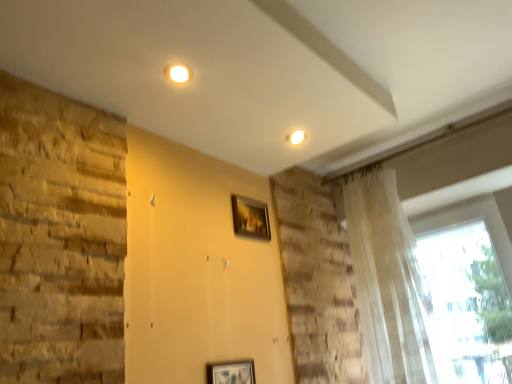
Question: Can you confirm if wooden frame at center is positioned to the left of translucent fabric curtain at upper right?

Choices:
 (A) no
 (B) yes

Answer: (B)

Question: Could you tell me if wooden frame at center is turned towards translucent fabric curtain at upper right?

Choices:
 (A) no
 (B) yes

Answer: (A)

Question: Does wooden frame at center come in front of translucent fabric curtain at upper right?

Choices:
 (A) yes
 (B) no

Answer: (B)

Question: Can you confirm if wooden frame at center is wider than translucent fabric curtain at upper right?

Choices:
 (A) yes
 (B) no

Answer: (B)

Question: From the image's perspective, is wooden frame at center located beneath translucent fabric curtain at upper right?

Choices:
 (A) yes
 (B) no

Answer: (B)

Question: Can you confirm if wooden frame at center is thinner than translucent fabric curtain at upper right?

Choices:
 (A) no
 (B) yes

Answer: (B)

Question: Can you confirm if translucent fabric curtain at upper right is shorter than wooden frame at center?

Choices:
 (A) no
 (B) yes

Answer: (A)

Question: Is translucent fabric curtain at upper right positioned beyond the bounds of wooden frame at center?

Choices:
 (A) no
 (B) yes

Answer: (B)

Question: Is translucent fabric curtain at upper right positioned before wooden frame at center?

Choices:
 (A) yes
 (B) no

Answer: (A)

Question: Can you confirm if translucent fabric curtain at upper right is positioned to the right of wooden frame at center?

Choices:
 (A) yes
 (B) no

Answer: (A)

Question: Is wooden frame at center surrounded by translucent fabric curtain at upper right?

Choices:
 (A) no
 (B) yes

Answer: (A)

Question: Is translucent fabric curtain at upper right bigger than wooden frame at center?

Choices:
 (A) yes
 (B) no

Answer: (A)

Question: Is point (264, 208) closer or farther from the camera than point (369, 292)?

Choices:
 (A) closer
 (B) farther

Answer: (A)